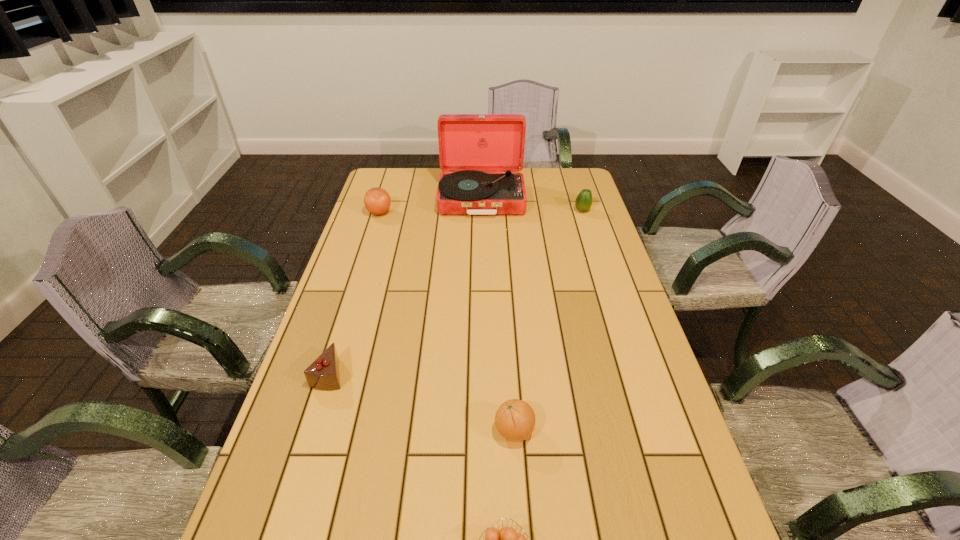
What are the coordinates of `the tallest object` in the screenshot? It's located at (481, 155).

Where is `the farthest orange fruit`? The width and height of the screenshot is (960, 540). the farthest orange fruit is located at coordinates (377, 201).

This screenshot has height=540, width=960. Find the location of `the leftmost orange fruit`. the leftmost orange fruit is located at coordinates (377, 201).

In order to click on avocado in this screenshot , I will do `click(583, 202)`.

Image resolution: width=960 pixels, height=540 pixels. In order to click on the second nearest orange fruit in this screenshot , I will do `click(515, 419)`.

This screenshot has height=540, width=960. In order to click on the fifth farthest object in this screenshot , I will do pyautogui.click(x=515, y=419).

This screenshot has height=540, width=960. Identify the location of chocolate cake. [x=323, y=374].

You are a GUI agent. You are given a task and a screenshot of the screen. Output one action in this format:
    pyautogui.click(x=<x>, y=<y>)
    Task: Click on the free location located 0.300m on the front-facing side of the phonograph_record
    
    Given the screenshot: What is the action you would take?
    pyautogui.click(x=482, y=272)

Locate an element on the screen. The height and width of the screenshot is (540, 960). free region located 0.080m on the right of the leftmost orange fruit is located at coordinates (414, 213).

The width and height of the screenshot is (960, 540). I want to click on vacant space positioned on the back of the rightmost object, so click(x=577, y=195).